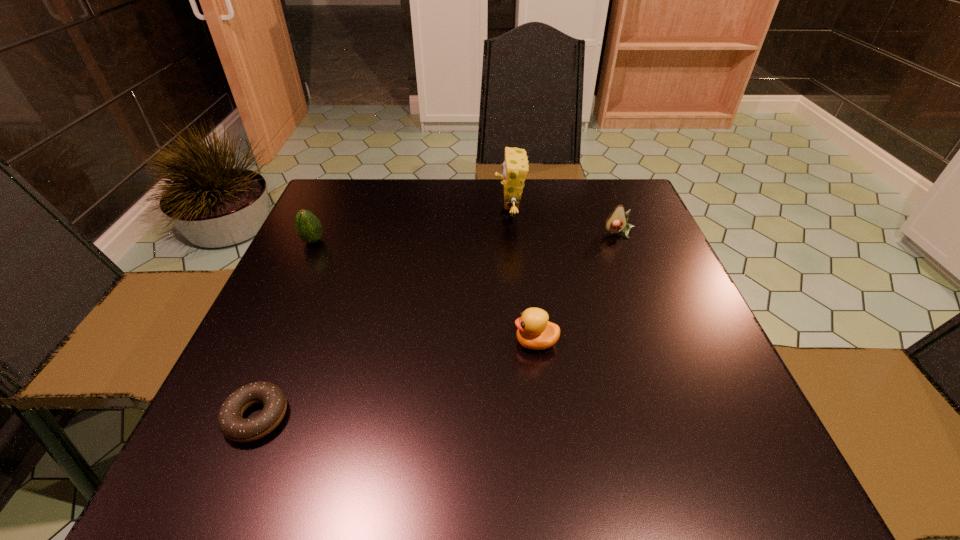
Where is `the tallest object`? The height and width of the screenshot is (540, 960). the tallest object is located at coordinates (515, 167).

The width and height of the screenshot is (960, 540). I want to click on the left avocado, so click(309, 228).

Where is `the rightmost object`? This screenshot has width=960, height=540. the rightmost object is located at coordinates (616, 222).

You are a GUI agent. You are given a task and a screenshot of the screen. Output one action in this format:
    pyautogui.click(x=<x>, y=<y>)
    Task: Click on the duckling
    
    Given the screenshot: What is the action you would take?
    pyautogui.click(x=534, y=331)

You are a GUI agent. You are given a task and a screenshot of the screen. Output one action in this format:
    pyautogui.click(x=<x>, y=<y>)
    Task: Click on the doughnut
    The image size is (960, 540).
    Given the screenshot: What is the action you would take?
    pyautogui.click(x=232, y=425)

You are a GUI agent. You are given a task and a screenshot of the screen. Output one action in this format:
    pyautogui.click(x=<x>, y=<y>)
    Task: Click on the nearest object
    The width and height of the screenshot is (960, 540).
    Given the screenshot: What is the action you would take?
    pyautogui.click(x=232, y=425)

Where is `free spot located on the face of the tallest object`? The height and width of the screenshot is (540, 960). free spot located on the face of the tallest object is located at coordinates (360, 215).

The image size is (960, 540). I want to click on vacant region located 0.180m on the face of the tallest object, so [x=425, y=215].

Locate an element on the screen. vacant space located 0.400m on the face of the tallest object is located at coordinates (341, 215).

Image resolution: width=960 pixels, height=540 pixels. I want to click on free region located on the front of the left avocado, so 296,280.